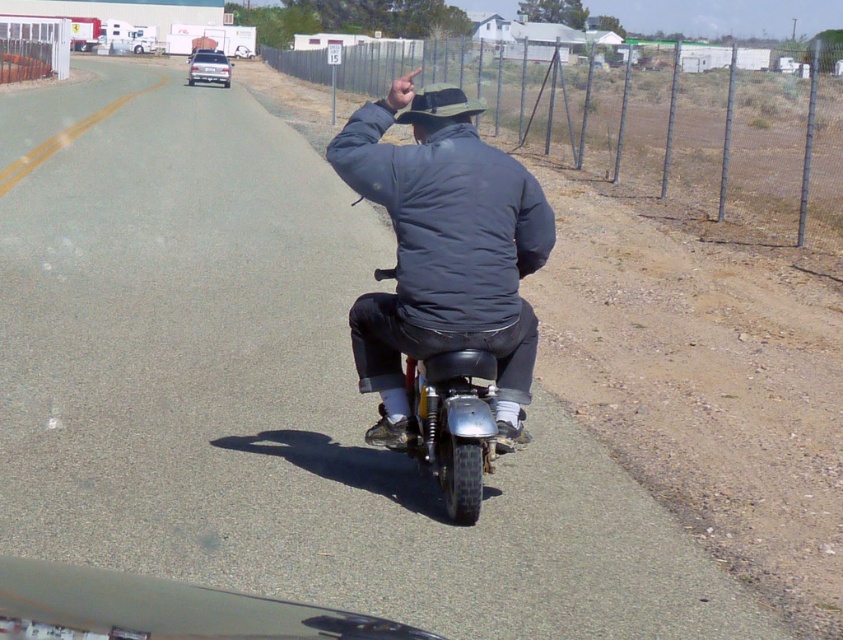
Can you confirm if dark gray puffy jacket at center is thinner than shiny chrome motorcycle at center?

Yes.

Is dark gray puffy jacket at center above shiny chrome motorcycle at center?

Indeed, dark gray puffy jacket at center is positioned over shiny chrome motorcycle at center.

Where is `dark gray puffy jacket at center`? dark gray puffy jacket at center is located at coordinates (417, 180).

Locate an element on the screen. The width and height of the screenshot is (843, 640). dark gray puffy jacket at center is located at coordinates (417, 180).

Does matte black motorcycle at center appear under shiny chrome motorcycle at center?

Actually, matte black motorcycle at center is above shiny chrome motorcycle at center.

Who is taller, matte black motorcycle at center or shiny chrome motorcycle at center?

Standing taller between the two is shiny chrome motorcycle at center.

Measure the distance between point (427,172) and camera.

5.02 meters

Identify the location of matte black motorcycle at center. This screenshot has width=843, height=640. (444, 285).

Who is more distant from viewer, [369,298] or [333,150]?

Point [333,150]

Who is higher up, matte black motorcycle at center or dark gray puffy jacket at center?

dark gray puffy jacket at center is higher up.

This screenshot has height=640, width=843. Find the location of `matte black motorcycle at center`. matte black motorcycle at center is located at coordinates (444, 285).